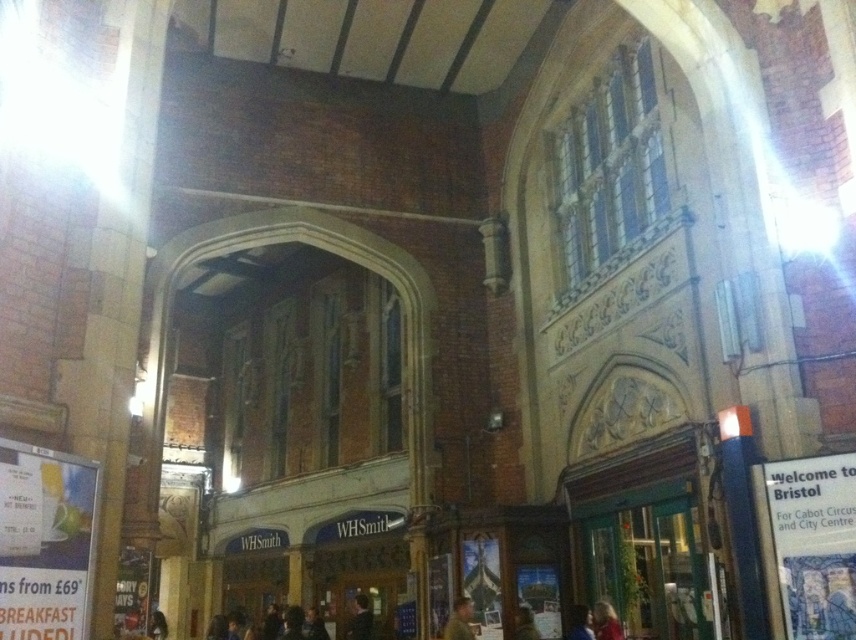
Between green fabric jacket at lower center and brown leather jacket at lower center, which one appears on the right side from the viewer's perspective?

brown leather jacket at lower center

Does green fabric jacket at lower center have a smaller size compared to brown leather jacket at lower center?

Yes, green fabric jacket at lower center is smaller than brown leather jacket at lower center.

Is point (462, 596) positioned before point (522, 624)?

No, it is behind (522, 624).

The height and width of the screenshot is (640, 856). Identify the location of green fabric jacket at lower center. (461, 620).

Which is below, dark brown leather jacket at center or brown leather jacket at lower center?

dark brown leather jacket at center is lower down.

Does dark brown leather jacket at center have a larger size compared to brown leather jacket at lower center?

Yes, dark brown leather jacket at center is bigger than brown leather jacket at lower center.

Between point (370, 628) and point (526, 611), which one is positioned in front?

Point (526, 611) is in front.

In order to click on dark brown leather jacket at center in this screenshot , I will do `click(360, 620)`.

Which is above, green fabric jacket at lower center or blonde hair at lower right?

green fabric jacket at lower center is higher up.

Is point (456, 608) less distant than point (598, 600)?

Yes, point (456, 608) is closer to viewer.

Between point (453, 618) and point (596, 618), which one is positioned in front?

Positioned in front is point (596, 618).

Identify the location of green fabric jacket at lower center. (461, 620).